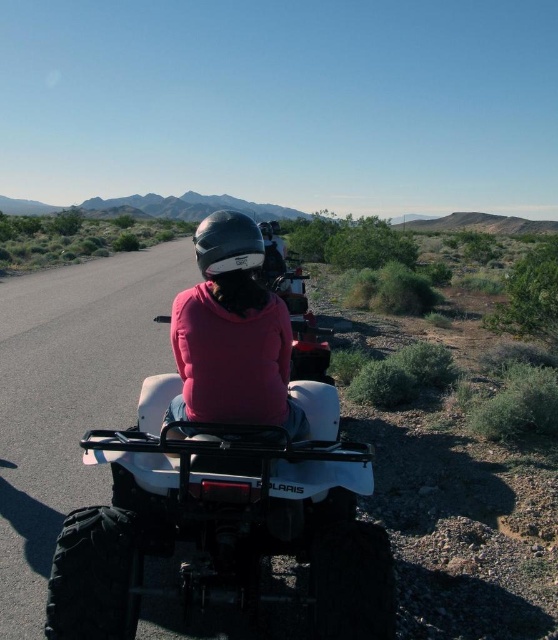
Question: Which of the following is the closest to the observer?

Choices:
 (A) glossy black helmet at center
 (B) pink matte helmet at center

Answer: (A)

Question: In this image, where is pink matte helmet at center located relative to glossy black helmet at center?

Choices:
 (A) above
 (B) below

Answer: (B)

Question: Which point is farther to the camera?

Choices:
 (A) pink matte helmet at center
 (B) glossy black helmet at center

Answer: (A)

Question: Considering the relative positions of pink matte helmet at center and glossy black helmet at center in the image provided, where is pink matte helmet at center located with respect to glossy black helmet at center?

Choices:
 (A) below
 (B) above

Answer: (A)

Question: Which object appears farthest from the camera in this image?

Choices:
 (A) glossy black helmet at center
 (B) pink matte helmet at center

Answer: (B)

Question: Can you confirm if pink matte helmet at center is thinner than glossy black helmet at center?

Choices:
 (A) no
 (B) yes

Answer: (B)